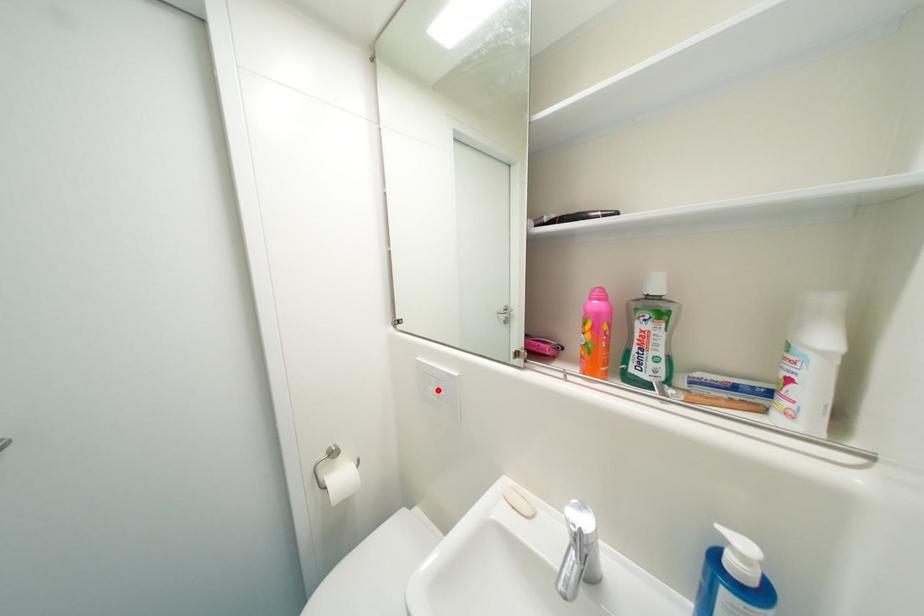
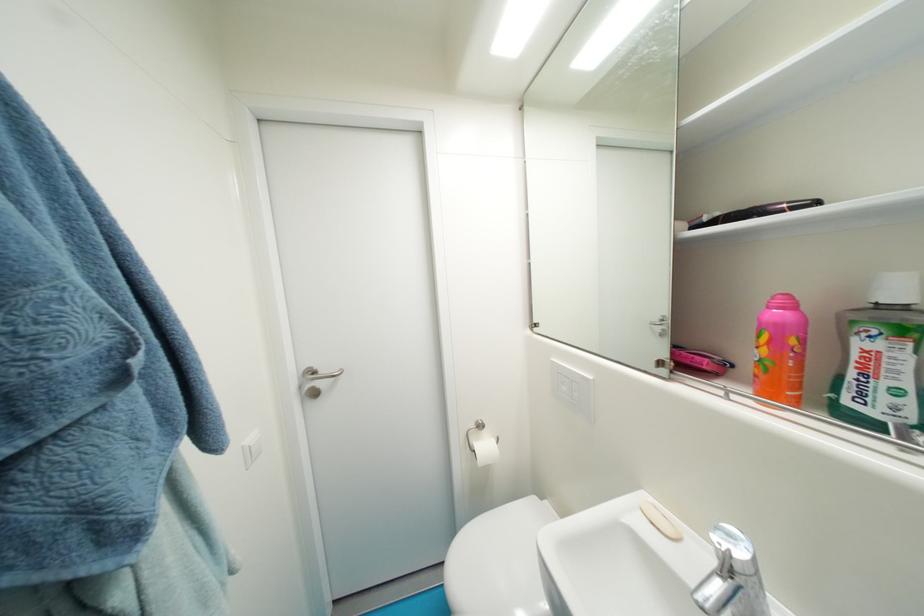
The point at the highlighted location is marked in the first image. Where is the corresponding point in the second image?

(570, 390)